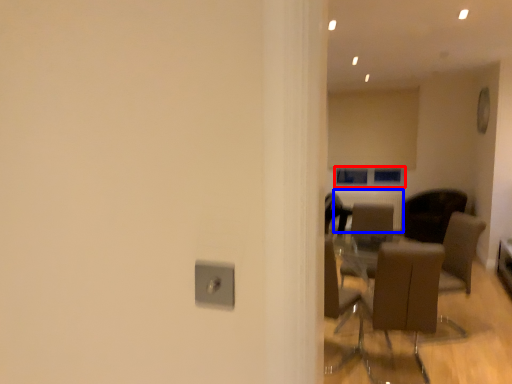
Question: Which of the following is the closest to the observer, window (highlighted by a red box) or radiator (highlighted by a blue box)?

Choices:
 (A) window
 (B) radiator

Answer: (B)